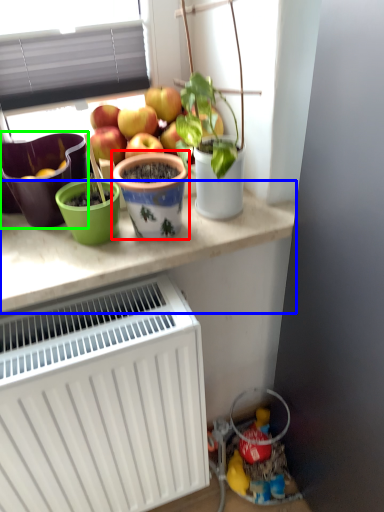
Question: Estimate the real-world distances between objects in this image. Which object is farther from flowerpot (highlighted by a red box), table (highlighted by a blue box) or flowerpot (highlighted by a green box)?

Choices:
 (A) table
 (B) flowerpot

Answer: (B)